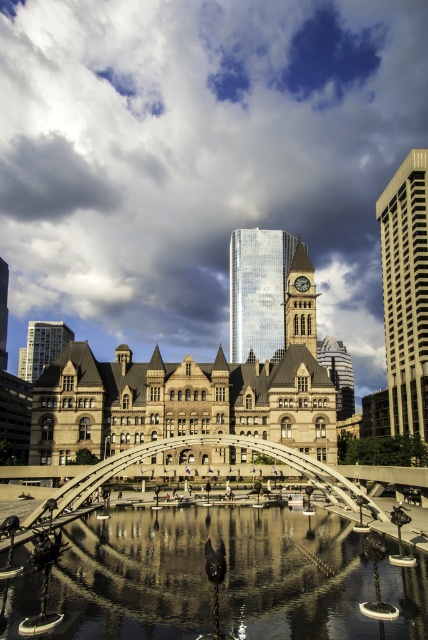
Question: Considering the real-world distances, which object is farthest from the brown stone clock tower at center?

Choices:
 (A) beige concrete skyscraper at right
 (B) metallic arched bridge at center

Answer: (B)

Question: Is beige concrete skyscraper at right smaller than matte glass tower at left?

Choices:
 (A) yes
 (B) no

Answer: (B)

Question: Is metallic arched bridge at center bigger than brown stone clock tower at center?

Choices:
 (A) yes
 (B) no

Answer: (A)

Question: Observing the image, what is the correct spatial positioning of beige concrete skyscraper at right in reference to matte glass tower at left?

Choices:
 (A) above
 (B) below

Answer: (A)

Question: Which point is closer to the camera?

Choices:
 (A) pyautogui.click(x=284, y=280)
 (B) pyautogui.click(x=56, y=346)

Answer: (B)

Question: Estimate the real-world distances between objects in this image. Which object is closer to the beige concrete skyscraper at right?

Choices:
 (A) reflective glass water at center
 (B) matte glass tower at left
 (C) shiny glass tower at center
 (D) metallic arched bridge at center

Answer: (C)